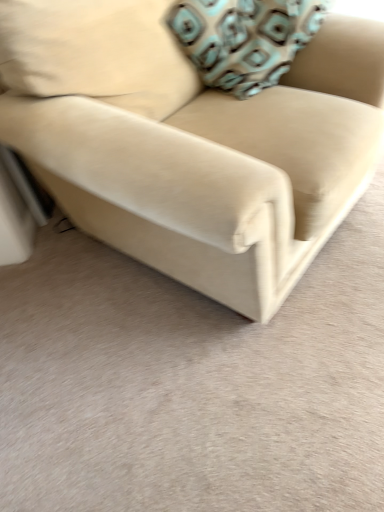
Question: In terms of height, does beige fabric couch at center look taller or shorter compared to teal-patterned fabric pillow at upper right?

Choices:
 (A) short
 (B) tall

Answer: (B)

Question: Based on their positions, is beige fabric couch at center located to the left or right of teal-patterned fabric pillow at upper right?

Choices:
 (A) left
 (B) right

Answer: (A)

Question: Based on their sizes in the image, would you say beige fabric couch at center is bigger or smaller than teal-patterned fabric pillow at upper right?

Choices:
 (A) big
 (B) small

Answer: (A)

Question: Looking at their shapes, would you say teal-patterned fabric pillow at upper right is wider or thinner than beige fabric couch at center?

Choices:
 (A) wide
 (B) thin

Answer: (B)

Question: From a real-world perspective, relative to beige fabric couch at center, is teal-patterned fabric pillow at upper right vertically above or below?

Choices:
 (A) above
 (B) below

Answer: (A)

Question: Considering the positions of teal-patterned fabric pillow at upper right and beige fabric couch at center in the image, is teal-patterned fabric pillow at upper right taller or shorter than beige fabric couch at center?

Choices:
 (A) short
 (B) tall

Answer: (A)

Question: Is teal-patterned fabric pillow at upper right in front of or behind beige fabric couch at center in the image?

Choices:
 (A) front
 (B) behind

Answer: (B)